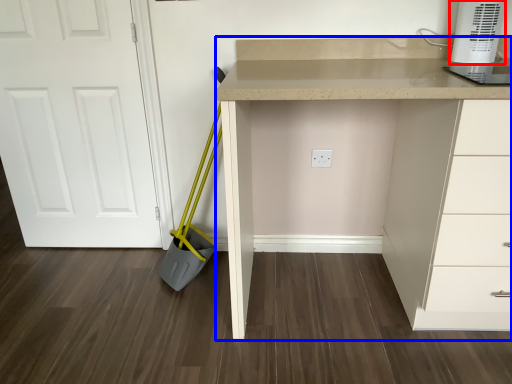
Question: Which of the following is the closest to the observer, home appliance (highlighted by a red box) or computer desk (highlighted by a blue box)?

Choices:
 (A) home appliance
 (B) computer desk

Answer: (B)